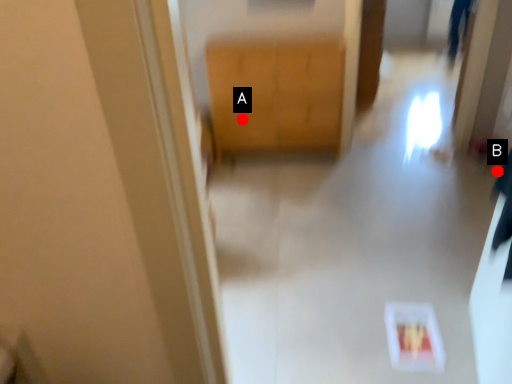
Question: Two points are circled on the image, labeled by A and B beside each circle. Which of the following is the closest to the observer?

Choices:
 (A) A is closer
 (B) B is closer

Answer: (B)